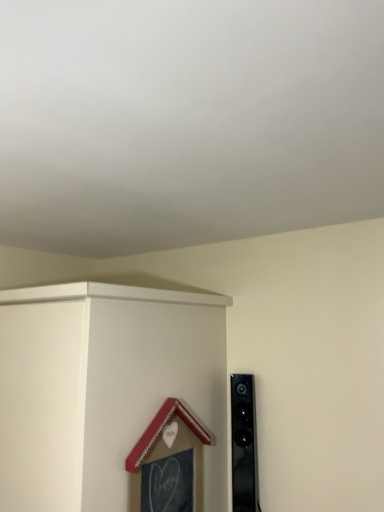
The width and height of the screenshot is (384, 512). What do you see at coordinates (108, 393) in the screenshot?
I see `wooden heart-shaped frame at upper center` at bounding box center [108, 393].

Where is `wooden heart-shaped frame at upper center`? The image size is (384, 512). wooden heart-shaped frame at upper center is located at coordinates [x=108, y=393].

At what (x,y) coordinates should I click in order to perform the action: click on wooden heart-shaped frame at upper center. Please return your answer as a coordinate pair (x, y). The height and width of the screenshot is (512, 384). Looking at the image, I should click on (108, 393).